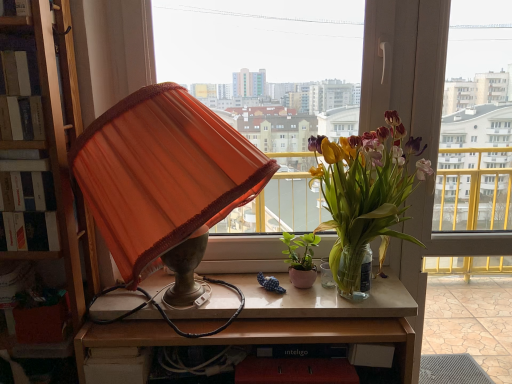
Locate an element on the screen. This screenshot has height=384, width=512. spots to the right of green matte plant at center, acting as the 1th houseplant starting from the left is located at coordinates (361, 292).